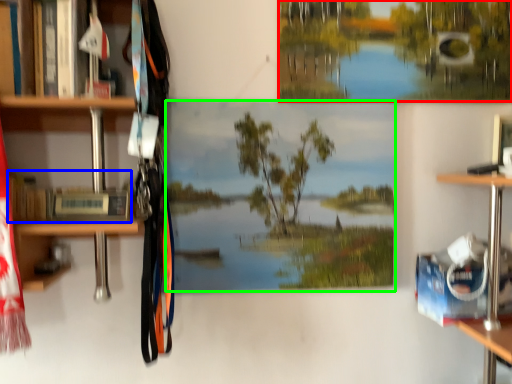
Question: Based on their relative distances, which object is nearer to tree (highlighted by a red box)? Choose from book (highlighted by a blue box) and mural (highlighted by a green box).

Choices:
 (A) book
 (B) mural

Answer: (B)